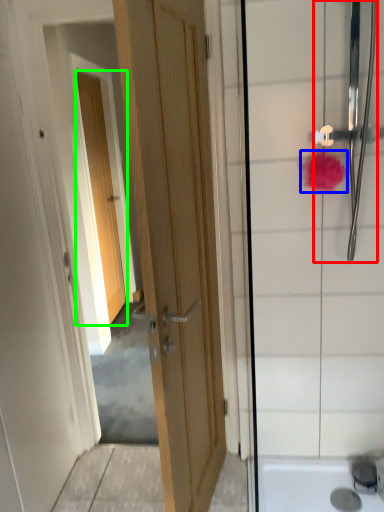
Question: Which object is positioned closest to shower (highlighted by a red box)? Select from flower (highlighted by a blue box) and door (highlighted by a green box).

Choices:
 (A) flower
 (B) door

Answer: (A)